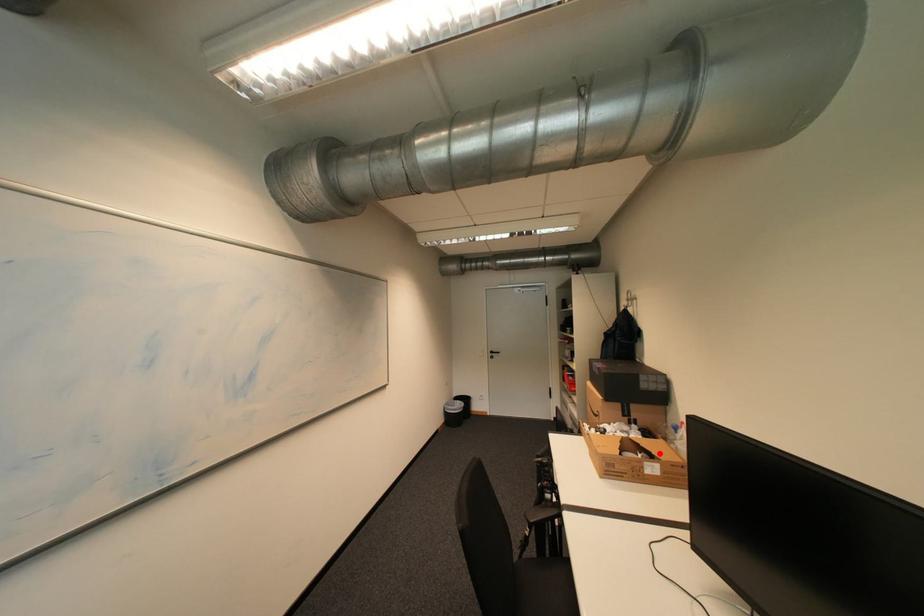
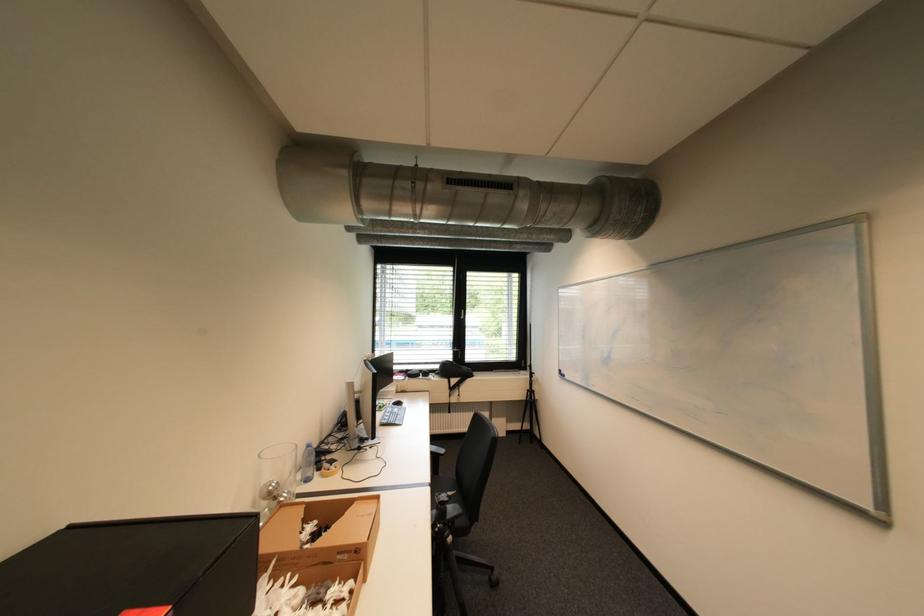
The point at the highlighted location is marked in the first image. Where is the corresponding point in the second image?

(311, 520)